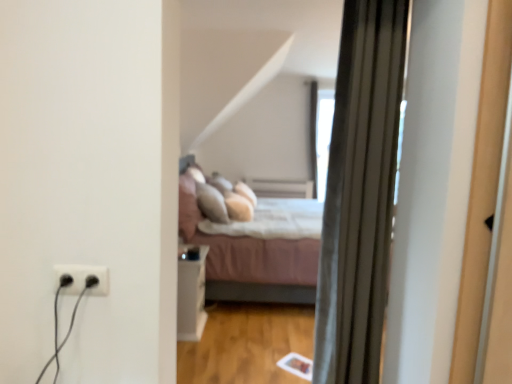
Question: Could you tell me if pink fabric bed at center is facing white glossy side table at center?

Choices:
 (A) yes
 (B) no

Answer: (B)

Question: Considering the relative positions of pink fabric bed at center and white glossy side table at center in the image provided, is pink fabric bed at center to the right of white glossy side table at center from the viewer's perspective?

Choices:
 (A) yes
 (B) no

Answer: (A)

Question: Is pink fabric bed at center next to white glossy side table at center?

Choices:
 (A) no
 (B) yes

Answer: (A)

Question: Is pink fabric bed at center surrounding white glossy side table at center?

Choices:
 (A) no
 (B) yes

Answer: (A)

Question: Does pink fabric bed at center have a greater width compared to white glossy side table at center?

Choices:
 (A) yes
 (B) no

Answer: (A)

Question: Does pink fabric bed at center have a larger size compared to white glossy side table at center?

Choices:
 (A) no
 (B) yes

Answer: (B)

Question: Is silky gray curtain at right oriented away from pink fabric bed at center?

Choices:
 (A) no
 (B) yes

Answer: (A)

Question: Is silky gray curtain at right shorter than pink fabric bed at center?

Choices:
 (A) yes
 (B) no

Answer: (B)

Question: Does silky gray curtain at right appear on the right side of pink fabric bed at center?

Choices:
 (A) yes
 (B) no

Answer: (A)

Question: From the image's perspective, does silky gray curtain at right appear higher than pink fabric bed at center?

Choices:
 (A) no
 (B) yes

Answer: (B)

Question: Could you tell me if silky gray curtain at right is turned towards pink fabric bed at center?

Choices:
 (A) yes
 (B) no

Answer: (A)

Question: Is silky gray curtain at right positioned beyond the bounds of pink fabric bed at center?

Choices:
 (A) no
 (B) yes

Answer: (B)

Question: Does pink fabric bed at center have a greater width compared to silky gray curtain at right?

Choices:
 (A) yes
 (B) no

Answer: (A)